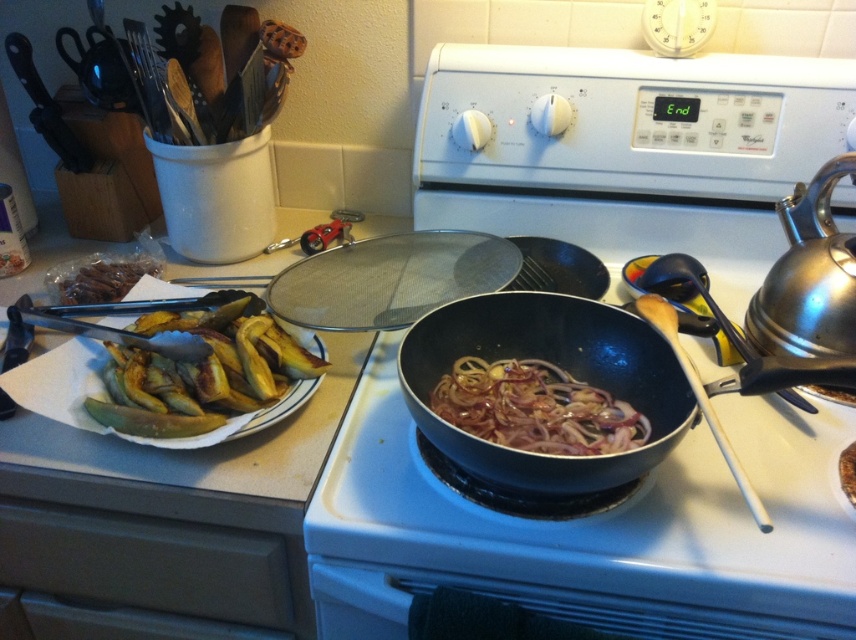
Between metallic mesh strainer at upper center and shiny metallic kettle at right, which one appears on the right side from the viewer's perspective?

Positioned to the right is shiny metallic kettle at right.

Can you confirm if metallic mesh strainer at upper center is shorter than shiny metallic kettle at right?

Yes.

Who is more distant from viewer, (288, 280) or (759, 317)?

The point (288, 280) is more distant.

Where is `metallic mesh strainer at upper center`? Image resolution: width=856 pixels, height=640 pixels. metallic mesh strainer at upper center is located at coordinates (389, 278).

Does shiny black wok at center have a larger size compared to brown matte dried beans at left?

Yes.

Between shiny black wok at center and brown matte dried beans at left, which one appears on the right side from the viewer's perspective?

shiny black wok at center

Does point (480, 452) come in front of point (134, 282)?

Yes.

I want to click on shiny black wok at center, so click(x=556, y=365).

Which is above, golden crispy plantains at left or white glossy oven at center?

golden crispy plantains at left is above.

Is golden crispy plantains at left thinner than white glossy oven at center?

Yes, golden crispy plantains at left is thinner than white glossy oven at center.

I want to click on golden crispy plantains at left, so click(x=203, y=369).

The image size is (856, 640). I want to click on golden crispy plantains at left, so click(x=203, y=369).